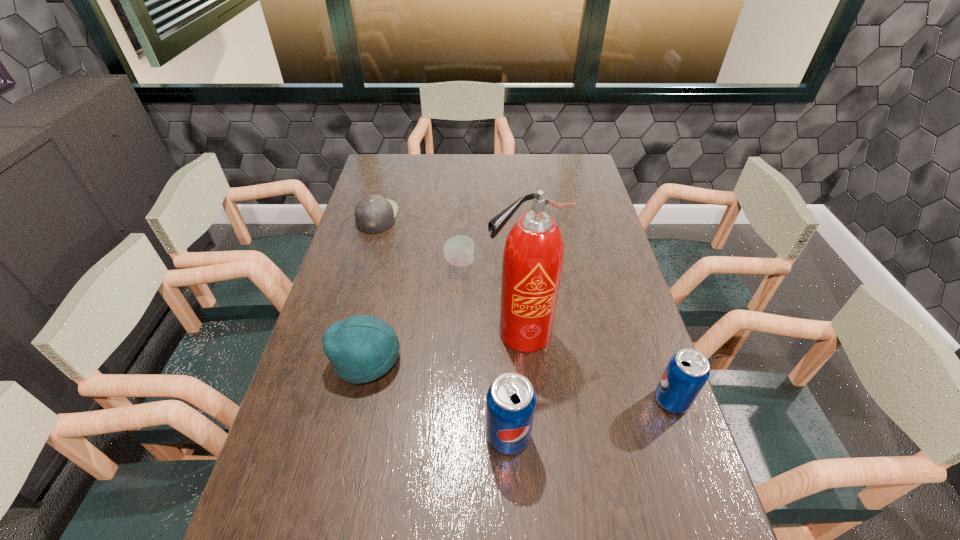
Please point a spot on the left to add another pop soda. Please provide its 2D coordinates. Your answer should be formatted as a tuple, i.e. [(x, y)], where the tuple contains the x and y coordinates of a point satisfying the conditions above.

[(322, 477)]